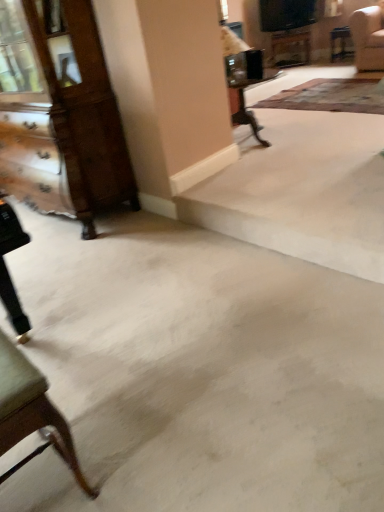
Find the location of a particular element. The height and width of the screenshot is (512, 384). patterned carpet at upper right is located at coordinates (330, 96).

Considering the points (293, 42) and (333, 95), which point is behind, point (293, 42) or point (333, 95)?

Point (293, 42)

Considering the sizes of objects wooden table at upper center and patterned carpet at upper right in the image provided, who is wider, wooden table at upper center or patterned carpet at upper right?

patterned carpet at upper right is wider.

From a real-world perspective, who is located lower, wooden table at upper center or patterned carpet at upper right?

patterned carpet at upper right, from a real-world perspective.

Is wooden dresser at left far away from wooden table at upper center?

That's right, there is a large distance between wooden dresser at left and wooden table at upper center.

Does point (31, 198) appear closer or farther from the camera than point (279, 34)?

Point (31, 198).

From the image's perspective, is wooden dresser at left on wooden table at upper center?

No, from the image's perspective, wooden dresser at left is not on top of wooden table at upper center.

What are the coordinates of `dresser on the left of wooden table at upper center` in the screenshot? It's located at (60, 114).

Is wooden table at upper center placed right next to wooden dresser at left?

They are not placed beside each other.

Which of these two, wooden table at upper center or wooden dresser at left, stands shorter?

wooden table at upper center.

Is wooden table at upper center oriented towards wooden dresser at left?

No, wooden table at upper center is not facing towards wooden dresser at left.

Looking at the image, does wooden table at upper center seem bigger or smaller compared to wooden dresser at left?

In the image, wooden table at upper center appears to be smaller than wooden dresser at left.

Who is shorter, wooden dresser at left or patterned carpet at upper right?

With less height is patterned carpet at upper right.

From the image's perspective, is wooden dresser at left positioned above or below patterned carpet at upper right?

Clearly, from the image's perspective, wooden dresser at left is below patterned carpet at upper right.

From a real-world perspective, is wooden dresser at left physically located above or below patterned carpet at upper right?

Clearly, from a real-world perspective, wooden dresser at left is above patterned carpet at upper right.

Looking at the image, does patterned carpet at upper right seem bigger or smaller compared to wooden dresser at left?

Considering their sizes, patterned carpet at upper right takes up less space than wooden dresser at left.

From the image's perspective, is patterned carpet at upper right positioned above or below wooden dresser at left?

Based on their image positions, patterned carpet at upper right is located above wooden dresser at left.

Is patterned carpet at upper right to the left or to the right of wooden dresser at left in the image?

Based on their positions, patterned carpet at upper right is located to the right of wooden dresser at left.

Would you say patterned carpet at upper right is to the left or to the right of wooden table at upper center in the picture?

From the image, it's evident that patterned carpet at upper right is to the right of wooden table at upper center.

From the image's perspective, is patterned carpet at upper right beneath wooden table at upper center?

Indeed, from the image's perspective, patterned carpet at upper right is shown beneath wooden table at upper center.

Considering the relative sizes of patterned carpet at upper right and wooden table at upper center in the image provided, is patterned carpet at upper right bigger than wooden table at upper center?

Yes, patterned carpet at upper right is bigger than wooden table at upper center.

This screenshot has height=512, width=384. In order to click on table located on the left of patterned carpet at upper right in this screenshot , I will do `click(290, 42)`.

The image size is (384, 512). In order to click on table that is behind the wooden dresser at left in this screenshot , I will do `click(290, 42)`.

Considering their positions, is wooden dresser at left positioned further to patterned carpet at upper right than wooden table at upper center?

wooden dresser at left is further to patterned carpet at upper right.

From the image, which object appears to be nearer to wooden dresser at left, wooden table at upper center or patterned carpet at upper right?

Among the two, patterned carpet at upper right is located nearer to wooden dresser at left.

Which object lies further to the anchor point wooden table at upper center, patterned carpet at upper right or wooden dresser at left?

Based on the image, wooden dresser at left appears to be further to wooden table at upper center.

Based on their spatial positions, is wooden table at upper center or wooden dresser at left closer to patterned carpet at upper right?

Among the two, wooden table at upper center is located nearer to patterned carpet at upper right.

Which object lies further to the anchor point wooden dresser at left, patterned carpet at upper right or wooden table at upper center?

wooden table at upper center.

In the scene shown: From the image, which object appears to be farther from wooden table at upper center, wooden dresser at left or patterned carpet at upper right?

Among the two, wooden dresser at left is located further to wooden table at upper center.

I want to click on mat located between wooden dresser at left and wooden table at upper center in the depth direction, so click(330, 96).